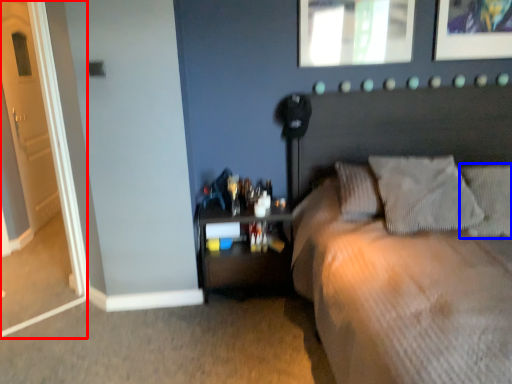
Question: Among these objects, which one is farthest to the camera, door (highlighted by a red box) or pillow (highlighted by a blue box)?

Choices:
 (A) door
 (B) pillow

Answer: (B)